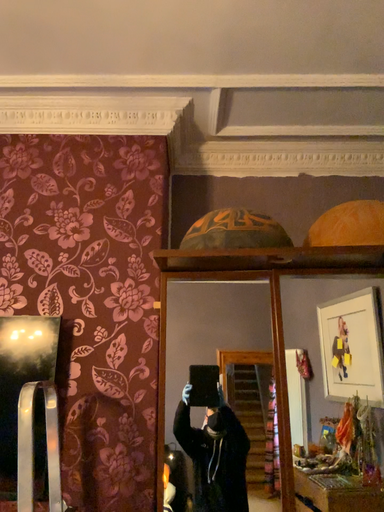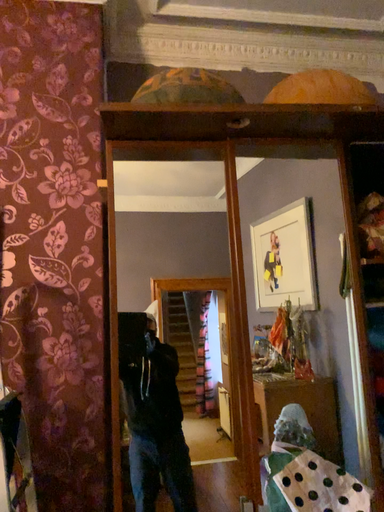
Question: How did the camera likely rotate when shooting the video?

Choices:
 (A) rotated right
 (B) rotated left

Answer: (A)